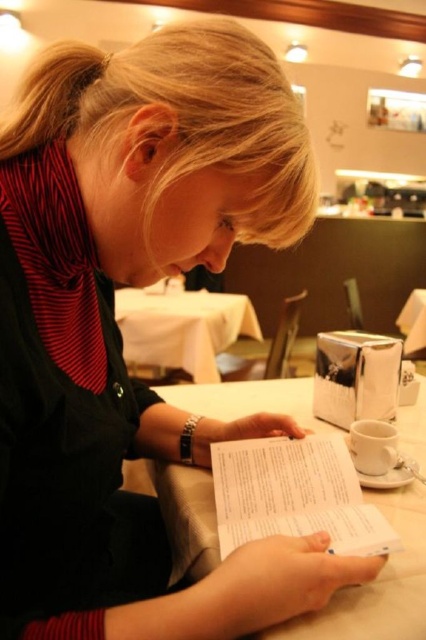
You are a waiter in a restaurant. You need to place a new order of a salad and a glass of water on the table. Where should you place them so they don not interfere with the existing items on the white smooth table at center?

Place the salad and water on the white smooth table at center in an area not occupied by the existing items, such as near the edge opposite the coffee cup and napkin holder.

You are a waiter in a restaurant and need to place a new menu on the table. The menu is the same size as the white paper book at center. Will the white smooth table at center have enough space to accommodate the new menu without overlapping anything?

The white smooth table at center is larger in size than the white paper book at center, so there should be enough space to place the new menu without overlapping anything.

You are a photographer trying to capture a closeup of the woman reading the document. You notice two points marked on the table. The first point is at coordinate point (270, 509) and the second is at point (241, 323). Which point should you focus on to ensure the closest subject detail?

Point (270, 509) is closer to the camera than point (241, 323), so focusing on point (270, 509) will ensure the closest subject detail.